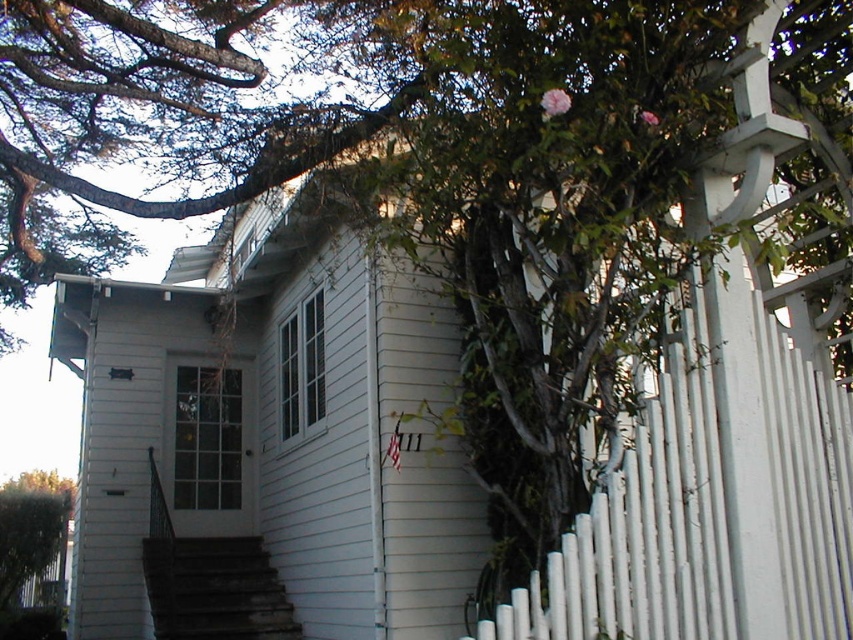
Question: Does dark gray concrete stairs at lower center appear under green leafy tree at lower left?

Choices:
 (A) no
 (B) yes

Answer: (A)

Question: Does dark gray concrete stairs at lower center have a greater width compared to green leafy tree at lower left?

Choices:
 (A) no
 (B) yes

Answer: (B)

Question: Among these points, which one is farthest from the camera?

Choices:
 (A) (49, 502)
 (B) (144, 561)

Answer: (A)

Question: Is dark gray concrete stairs at lower center thinner than green leafy tree at lower left?

Choices:
 (A) no
 (B) yes

Answer: (A)

Question: Which point is farther to the camera?

Choices:
 (A) dark gray concrete stairs at lower center
 (B) green leafy tree at lower left

Answer: (B)